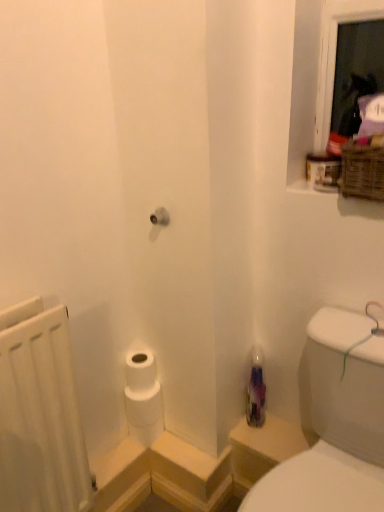
Question: Does translucent purple bottle at lower right have a greater height compared to woven brown basket at upper right?

Choices:
 (A) yes
 (B) no

Answer: (A)

Question: Is translucent purple bottle at lower right with woven brown basket at upper right?

Choices:
 (A) no
 (B) yes

Answer: (A)

Question: Is translucent purple bottle at lower right positioned far away from woven brown basket at upper right?

Choices:
 (A) no
 (B) yes

Answer: (A)

Question: From the image's perspective, is translucent purple bottle at lower right under woven brown basket at upper right?

Choices:
 (A) no
 (B) yes

Answer: (B)

Question: Can you confirm if translucent purple bottle at lower right is bigger than woven brown basket at upper right?

Choices:
 (A) yes
 (B) no

Answer: (B)

Question: In the image, is woven brown basket at upper right on the left side or the right side of white matte radiator at left?

Choices:
 (A) left
 (B) right

Answer: (B)

Question: From a real-world perspective, relative to white matte radiator at left, is woven brown basket at upper right vertically above or below?

Choices:
 (A) below
 (B) above

Answer: (B)

Question: In terms of height, does woven brown basket at upper right look taller or shorter compared to white matte radiator at left?

Choices:
 (A) tall
 (B) short

Answer: (B)

Question: Considering the positions of point click(382, 167) and point click(54, 478), is point click(382, 167) closer or farther from the camera than point click(54, 478)?

Choices:
 (A) closer
 (B) farther

Answer: (A)

Question: Considering their positions, is woven brown basket at upper right located in front of or behind translucent purple bottle at lower right?

Choices:
 (A) front
 (B) behind

Answer: (A)

Question: Looking at their shapes, would you say woven brown basket at upper right is wider or thinner than translucent purple bottle at lower right?

Choices:
 (A) thin
 (B) wide

Answer: (B)

Question: Looking at the image, does woven brown basket at upper right seem bigger or smaller compared to translucent purple bottle at lower right?

Choices:
 (A) big
 (B) small

Answer: (A)

Question: From the image's perspective, is woven brown basket at upper right above or below translucent purple bottle at lower right?

Choices:
 (A) below
 (B) above

Answer: (B)

Question: Looking at the image, does transparent plastic bottle at lower right seem bigger or smaller compared to white matte radiator at left?

Choices:
 (A) big
 (B) small

Answer: (A)

Question: From the image's perspective, is transparent plastic bottle at lower right located above or below white matte radiator at left?

Choices:
 (A) below
 (B) above

Answer: (A)